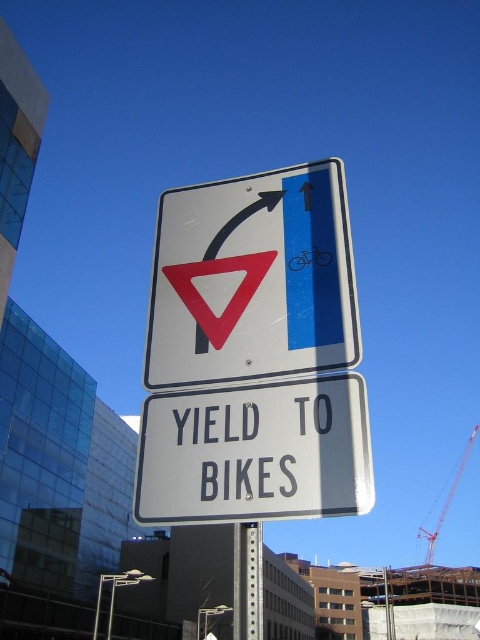
Question: Estimate the real-world distances between objects in this image. Which object is farther from the red metal crane at upper right?

Choices:
 (A) white plastic sign at center
 (B) metallic silver sign at center

Answer: (A)

Question: Which of the following is the closest to the observer?

Choices:
 (A) (458, 468)
 (B) (197, 486)

Answer: (B)

Question: Estimate the real-world distances between objects in this image. Which object is closer to the metallic silver sign at center?

Choices:
 (A) white plastic sign at center
 (B) red metal crane at upper right

Answer: (A)

Question: Is white plastic sign at center to the left of red metal crane at upper right from the viewer's perspective?

Choices:
 (A) yes
 (B) no

Answer: (A)

Question: Can you confirm if metallic silver sign at center is positioned above white plastic sign at center?

Choices:
 (A) no
 (B) yes

Answer: (B)

Question: Does metallic silver sign at center appear under white plastic sign at center?

Choices:
 (A) yes
 (B) no

Answer: (B)